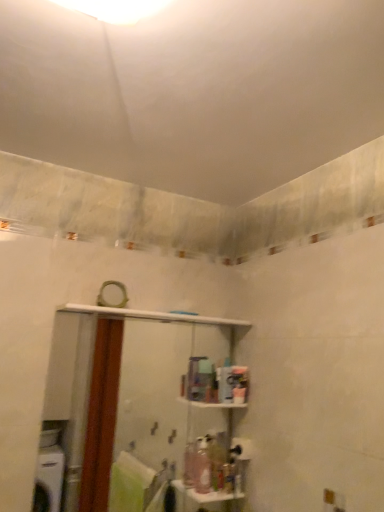
Question: Would you say pink plastic bottle at center, arranged as the 1th toiletry when viewed from the left, is outside translucent plastic soap dispenser at lower center, marked as the second toiletry in a left-to-right arrangement?

Choices:
 (A) no
 (B) yes

Answer: (B)

Question: Is pink plastic bottle at center, the second toiletry from the right, oriented away from translucent plastic soap dispenser at lower center, marked as the second toiletry in a left-to-right arrangement?

Choices:
 (A) no
 (B) yes

Answer: (A)

Question: Is pink plastic bottle at center, the second toiletry from the right, positioned in front of translucent plastic soap dispenser at lower center, marked as the second toiletry in a left-to-right arrangement?

Choices:
 (A) yes
 (B) no

Answer: (A)

Question: Is pink plastic bottle at center, arranged as the 1th toiletry when viewed from the left, far away from translucent plastic soap dispenser at lower center, marked as the second toiletry in a left-to-right arrangement?

Choices:
 (A) yes
 (B) no

Answer: (B)

Question: Can you confirm if pink plastic bottle at center, the second toiletry from the right, is positioned to the right of translucent plastic soap dispenser at lower center, the first toiletry in the right-to-left sequence?

Choices:
 (A) yes
 (B) no

Answer: (B)

Question: Is point (125, 499) positioned closer to the camera than point (226, 476)?

Choices:
 (A) farther
 (B) closer

Answer: (A)

Question: Is white glossy shelf at center to the left or to the right of translucent plastic soap dispenser at lower center, marked as the second toiletry in a left-to-right arrangement, in the image?

Choices:
 (A) left
 (B) right

Answer: (A)

Question: Is white glossy shelf at center spatially inside translucent plastic soap dispenser at lower center, the first toiletry in the right-to-left sequence, or outside of it?

Choices:
 (A) inside
 (B) outside

Answer: (B)

Question: Considering the positions of white glossy shelf at center and translucent plastic soap dispenser at lower center, marked as the second toiletry in a left-to-right arrangement, in the image, is white glossy shelf at center bigger or smaller than translucent plastic soap dispenser at lower center, marked as the second toiletry in a left-to-right arrangement,?

Choices:
 (A) big
 (B) small

Answer: (A)

Question: In the image, is pink plastic bottle at center, the second toiletry from the right, positioned in front of or behind white glossy shelf at center?

Choices:
 (A) front
 (B) behind

Answer: (B)

Question: Based on their positions, is pink plastic bottle at center, the second toiletry from the right, located to the left or right of white glossy shelf at center?

Choices:
 (A) left
 (B) right

Answer: (B)

Question: Is pink plastic bottle at center, the second toiletry from the right, taller or shorter than white glossy shelf at center?

Choices:
 (A) short
 (B) tall

Answer: (A)

Question: From the image's perspective, relative to white glossy shelf at center, is pink plastic bottle at center, the second toiletry from the right, above or below?

Choices:
 (A) above
 (B) below

Answer: (B)

Question: In terms of height, does translucent plastic soap dispenser at lower center, the first toiletry in the right-to-left sequence, look taller or shorter compared to pink plastic bottle at center, the second toiletry from the right?

Choices:
 (A) tall
 (B) short

Answer: (B)

Question: From a real-world perspective, is translucent plastic soap dispenser at lower center, the first toiletry in the right-to-left sequence, positioned above or below pink plastic bottle at center, arranged as the 1th toiletry when viewed from the left?

Choices:
 (A) above
 (B) below

Answer: (B)